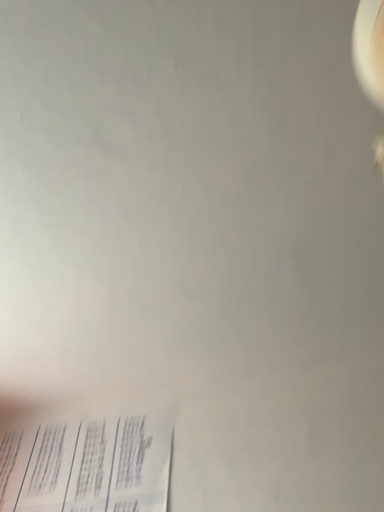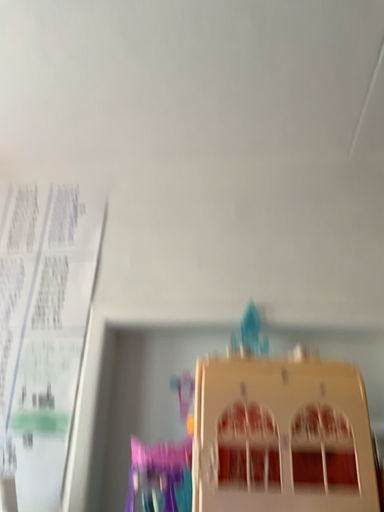
Question: How did the camera likely rotate when shooting the video?

Choices:
 (A) rotated downward
 (B) rotated upward

Answer: (A)